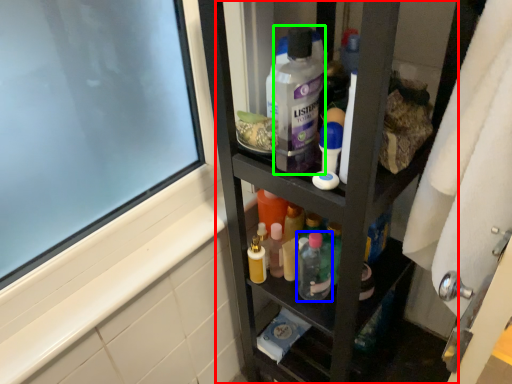
Question: Considering the real-world distances, which object is farthest from cabinet (highlighted by a red box)? toiletry (highlighted by a blue box) or cleaning product (highlighted by a green box)?

Choices:
 (A) toiletry
 (B) cleaning product

Answer: (B)